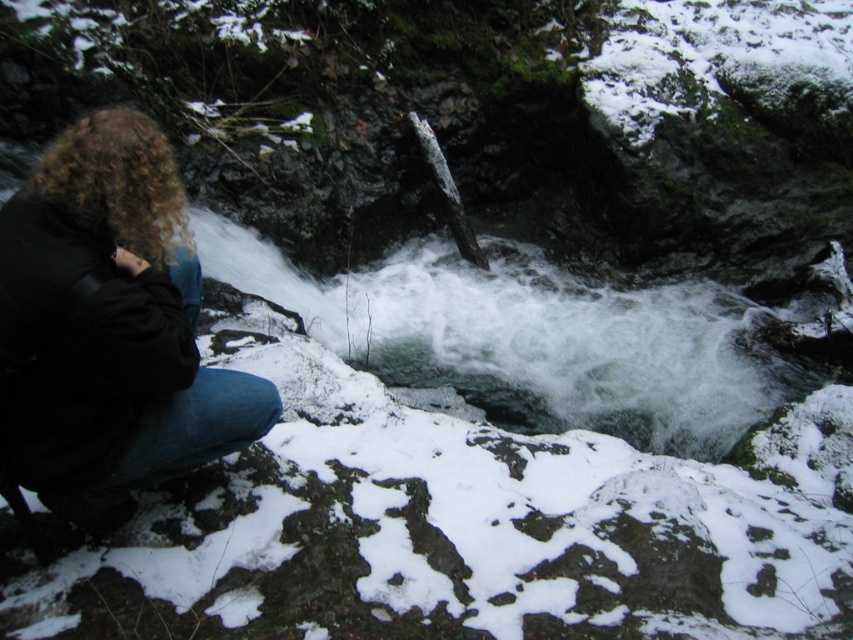
Question: Which point is closer to the camera?

Choices:
 (A) (399, 292)
 (B) (39, 268)

Answer: (B)

Question: Does black leather jacket at left appear on the right side of white frothy water at center?

Choices:
 (A) yes
 (B) no

Answer: (B)

Question: Among these points, which one is farthest from the camera?

Choices:
 (A) (302, 298)
 (B) (97, 417)

Answer: (A)

Question: Is black leather jacket at left closer to the viewer compared to white frothy water at center?

Choices:
 (A) no
 (B) yes

Answer: (B)

Question: Which object appears closest to the camera in this image?

Choices:
 (A) black leather jacket at left
 (B) white frothy water at center

Answer: (A)

Question: Is black leather jacket at left to the left of white frothy water at center from the viewer's perspective?

Choices:
 (A) yes
 (B) no

Answer: (A)